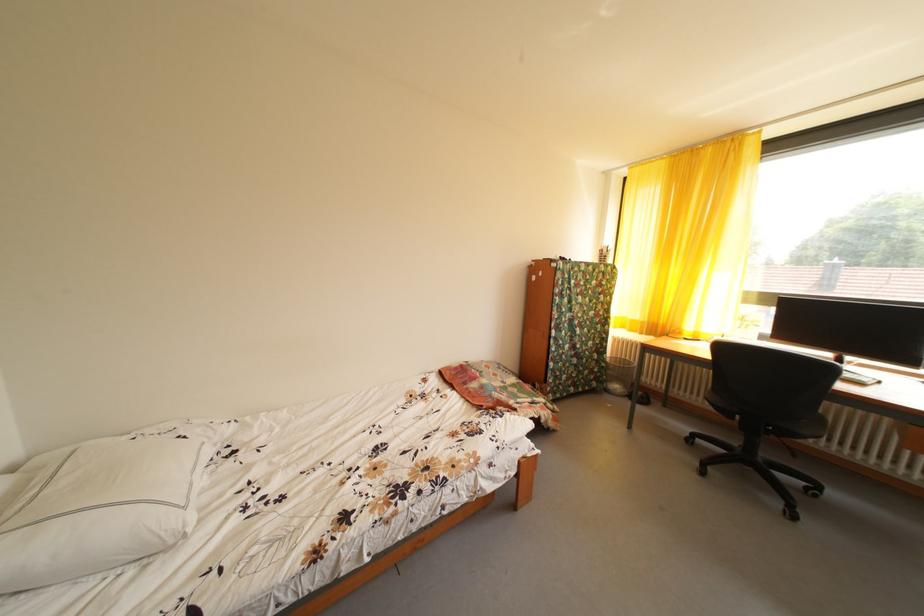
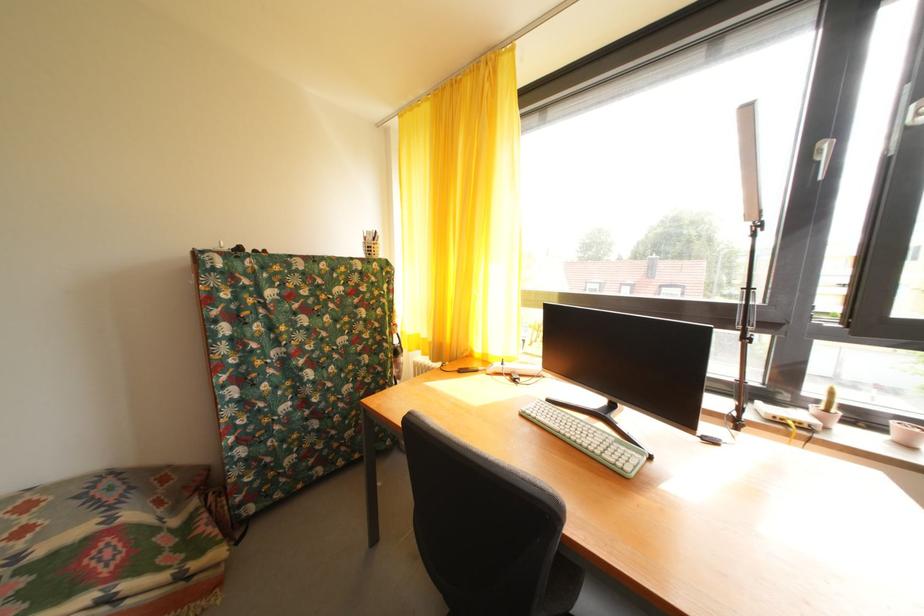
Where in the second image is the point corresponding to point 640,326 from the first image?

(432, 346)